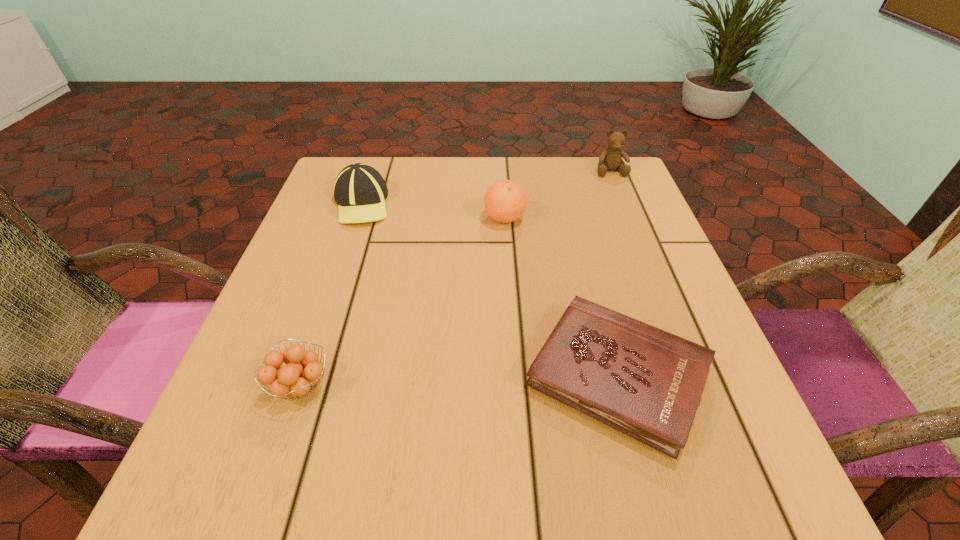
The image size is (960, 540). I want to click on object located in the far left corner section of the desktop, so [360, 191].

In order to click on object positioned at the far right corner in this screenshot , I will do `click(610, 159)`.

The width and height of the screenshot is (960, 540). I want to click on object present at the near right corner, so click(x=647, y=383).

In the image, there is a desktop. In order to click on vacant space at the far edge in this screenshot , I will do `click(501, 180)`.

This screenshot has width=960, height=540. In order to click on free location at the near edge of the desktop in this screenshot , I will do `click(520, 505)`.

I want to click on vacant space at the left edge of the desktop, so click(335, 353).

Image resolution: width=960 pixels, height=540 pixels. In order to click on vacant space at the right edge of the desktop in this screenshot , I will do `click(664, 292)`.

You are a GUI agent. You are given a task and a screenshot of the screen. Output one action in this format:
    pyautogui.click(x=<x>, y=<y>)
    Task: Click on the vacant space at the far left corner
    Image resolution: width=960 pixels, height=540 pixels.
    Given the screenshot: What is the action you would take?
    pyautogui.click(x=325, y=203)

The height and width of the screenshot is (540, 960). In order to click on free region at the far right corner in this screenshot , I will do `click(588, 192)`.

This screenshot has height=540, width=960. I want to click on blank region between the right orange fruit and the teddy bear, so click(x=558, y=194).